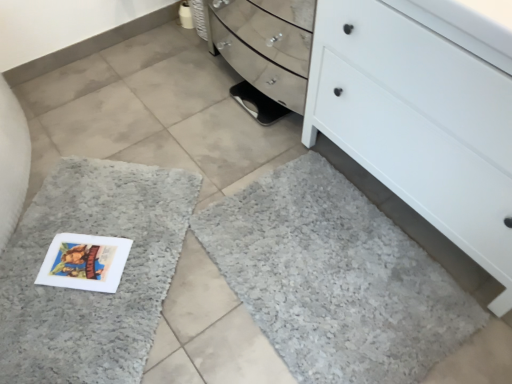
You are a GUI agent. You are given a task and a screenshot of the screen. Output one action in this format:
    pyautogui.click(x=<x>, y=<y>)
    Task: Click on the free point above gray shaggy bath mat at lower left, which is the second bath mat from right to left (from a real-world perspective)
    
    Given the screenshot: What is the action you would take?
    pyautogui.click(x=90, y=253)